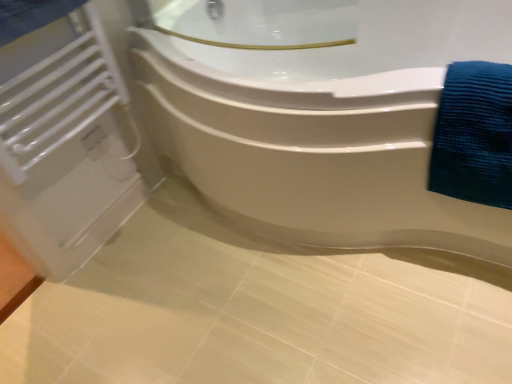
Locate an element on the screen. The image size is (512, 384). free point below white matte radiator at left (from a real-world perspective) is located at coordinates (129, 223).